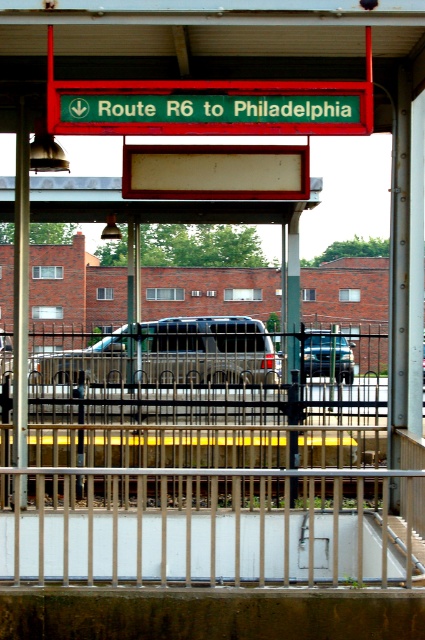
Question: Which of these objects is positioned closest to the white metal rail at center?

Choices:
 (A) metallic silver suv at center
 (B) silver metallic suv at center

Answer: (A)

Question: Is white metal rail at center to the left of silver metallic suv at center from the viewer's perspective?

Choices:
 (A) yes
 (B) no

Answer: (B)

Question: Which point appears farthest from the camera in this image?

Choices:
 (A) (314, 365)
 (B) (141, 499)
 (C) (166, 317)

Answer: (C)

Question: Can you confirm if white metal rail at center is positioned to the left of metallic silver suv at center?

Choices:
 (A) yes
 (B) no

Answer: (A)

Question: Can you confirm if white metal rail at center is bigger than silver metallic suv at center?

Choices:
 (A) no
 (B) yes

Answer: (A)

Question: Which object is farther from the camera taking this photo?

Choices:
 (A) silver metallic suv at center
 (B) white metal rail at center
 (C) metallic silver suv at center

Answer: (A)